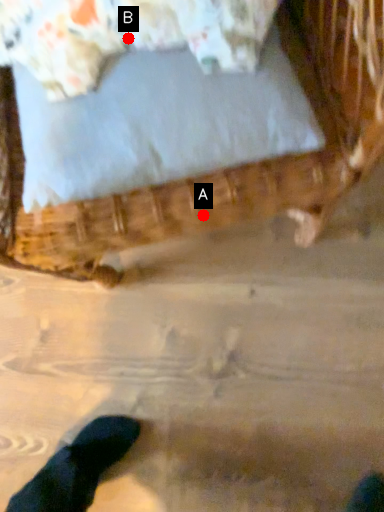
Question: Two points are circled on the image, labeled by A and B beside each circle. Which point is closer to the camera?

Choices:
 (A) A is closer
 (B) B is closer

Answer: (B)